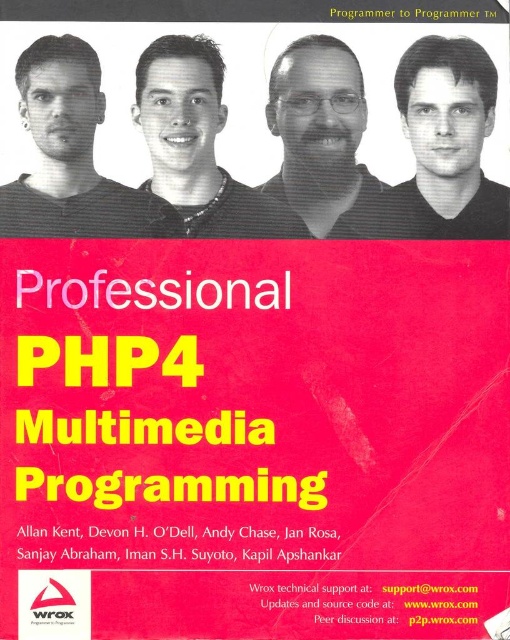
Based on the photo, looking at the book cover, you see the matte black face at upper left and the matte black face at center. Which one is positioned to the left?

The matte black face at upper left is positioned to the left of the matte black face at center.